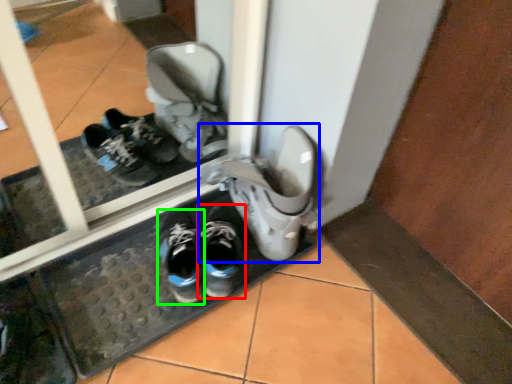
Question: Based on their relative distances, which object is farther from footwear (highlighted by a red box)? Choose from footwear (highlighted by a blue box) and running shoe (highlighted by a green box).

Choices:
 (A) footwear
 (B) running shoe

Answer: (A)